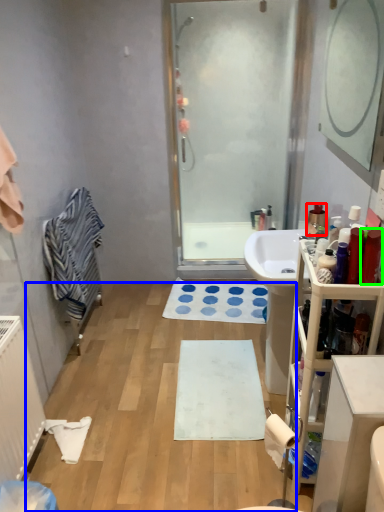
Question: Which is nearer to the toiletry (highlighted by a red box)? plain (highlighted by a blue box) or toiletry (highlighted by a green box).

Choices:
 (A) plain
 (B) toiletry

Answer: (B)